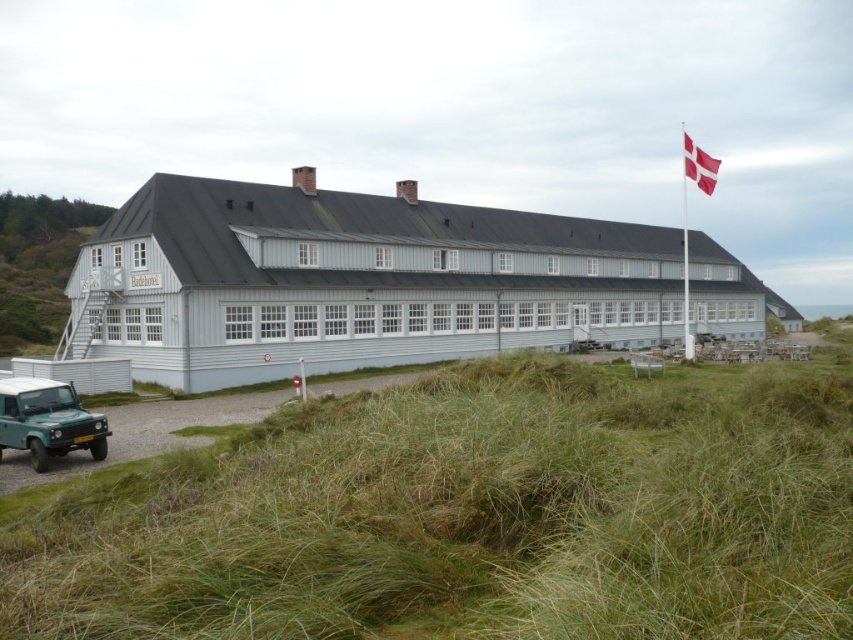
You are a photographer setting up a shot of the building. You want to place your tripod in the open area between the green grassy at lower left and the white wooden flag pole at upper right. Which object is closer to the tripod if it is placed exactly halfway between them?

The green grassy at lower left is closer to the tripod placed exactly halfway between them because it is smaller in size compared to the white wooden flag pole at upper right.